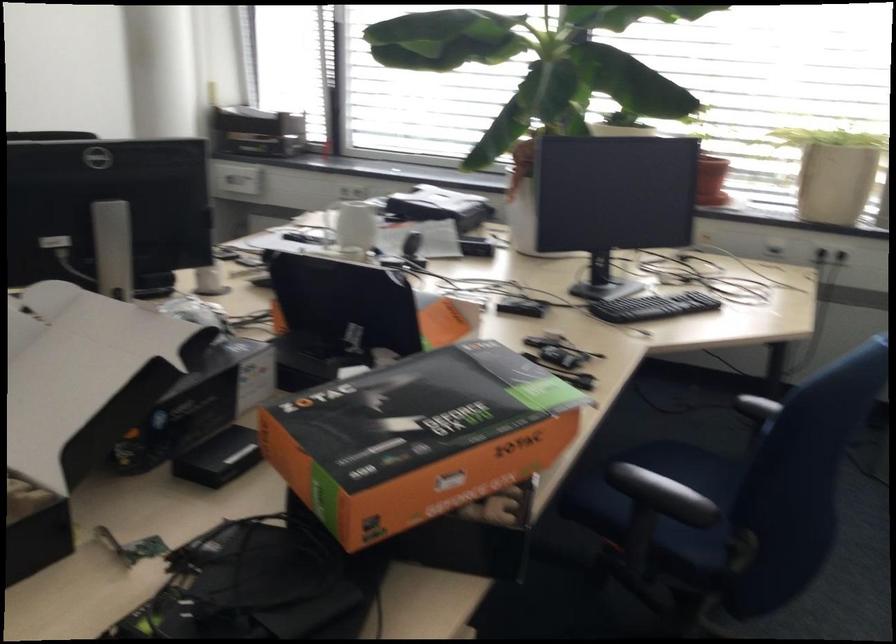
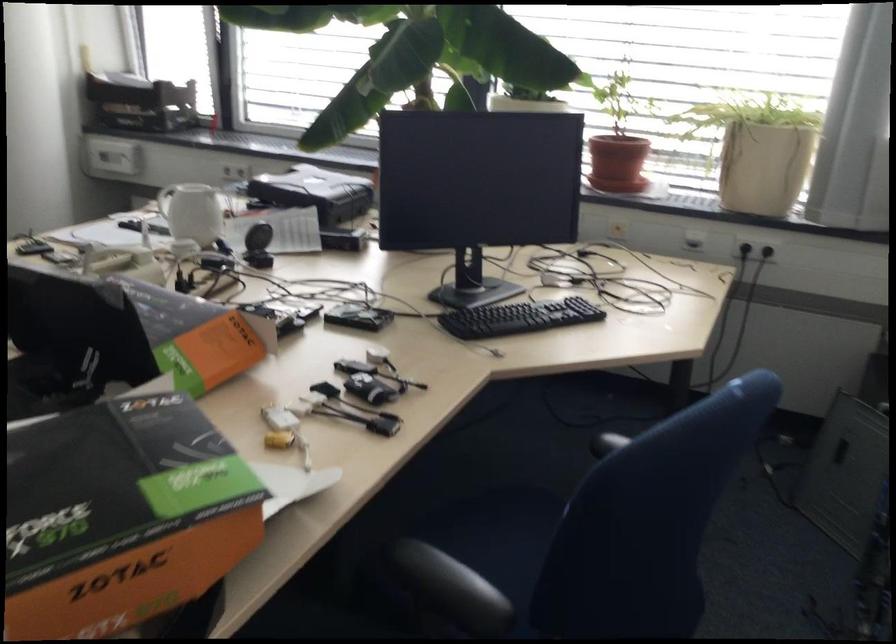
The images are taken continuously from a first-person perspective. In which direction are you moving?

The cameraman moved toward right, forward.